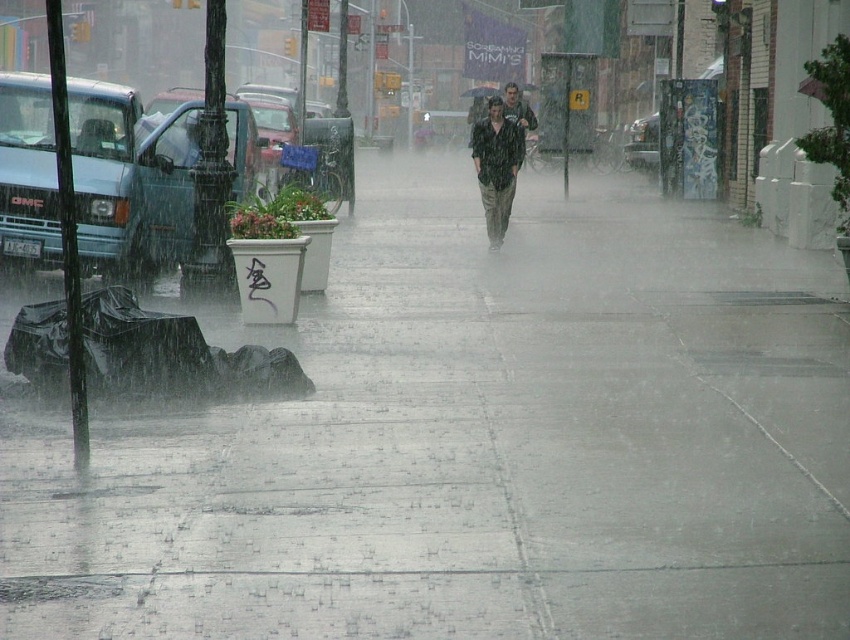
Question: Can you confirm if matte black shirt at center is bigger than transparent plastic umbrella at center?

Choices:
 (A) no
 (B) yes

Answer: (A)

Question: Among these points, which one is farthest from the camera?

Choices:
 (A) (513, 120)
 (B) (469, 93)

Answer: (B)

Question: Where is matte black shirt at center located in relation to transparent plastic umbrella at center in the image?

Choices:
 (A) left
 (B) right

Answer: (A)

Question: Which point is farther from the camera taking this photo?

Choices:
 (A) (482, 125)
 (B) (465, 96)

Answer: (B)

Question: Is matte black shirt at center to the right of transparent plastic umbrella at center from the viewer's perspective?

Choices:
 (A) no
 (B) yes

Answer: (A)